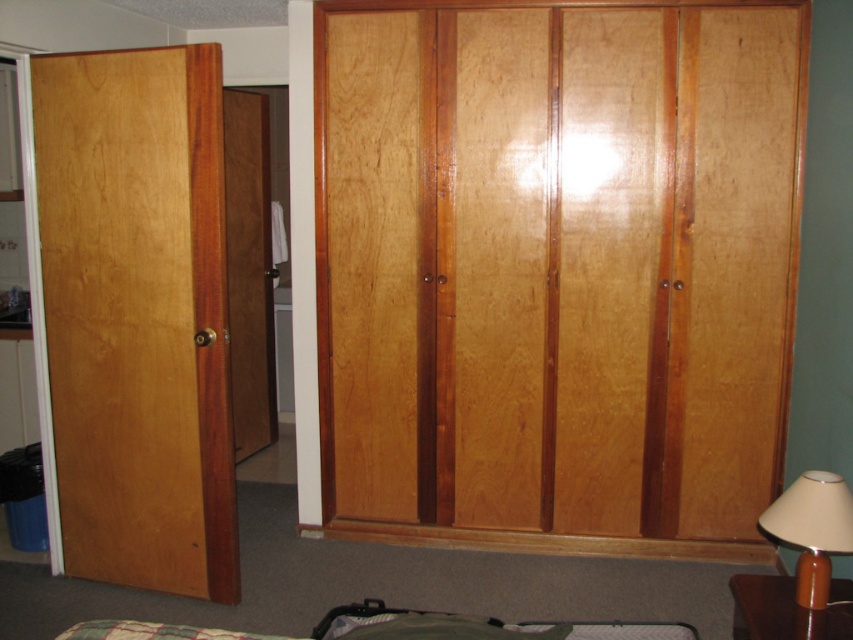
Question: Which object is farther from the camera taking this photo?

Choices:
 (A) brown matte lamp at lower right
 (B) wooden door at center
 (C) light brown wood door at left
 (D) glossy wood dresser at center

Answer: (B)

Question: Does wooden door at center appear on the left side of green plaid fabric bed at lower center?

Choices:
 (A) yes
 (B) no

Answer: (A)

Question: Is glossy wood dresser at center above light brown wood door at left?

Choices:
 (A) yes
 (B) no

Answer: (A)

Question: Which is farther from the light brown wood door at left?

Choices:
 (A) brown matte lamp at lower right
 (B) wooden door at center

Answer: (A)

Question: Which object is farther from the camera taking this photo?

Choices:
 (A) light brown wood door at left
 (B) wooden door at center
 (C) glossy wood dresser at center

Answer: (B)

Question: Does glossy wood dresser at center appear on the left side of light brown wood door at left?

Choices:
 (A) yes
 (B) no

Answer: (B)